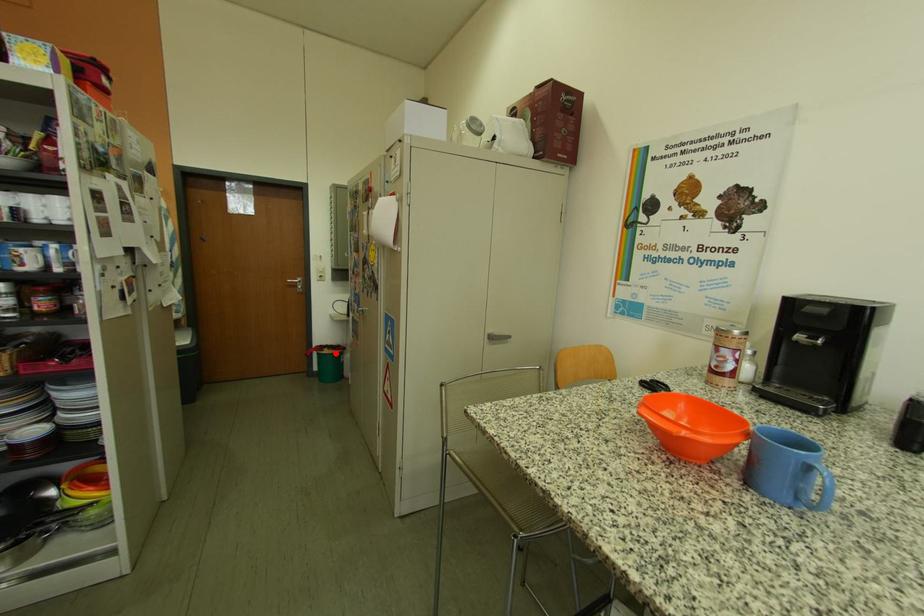
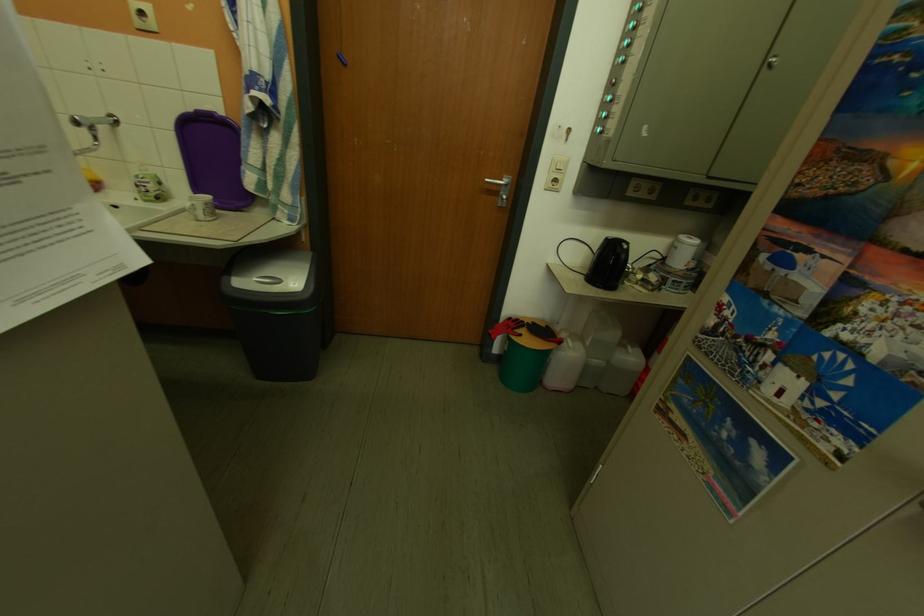
Question: I am providing you with two images of the same scene from different viewpoints. In image1, a red point is highlighted. Considering the same 3D point in image2, which of the following is correct?

Choices:
 (A) It is closer
 (B) It is farther

Answer: (A)